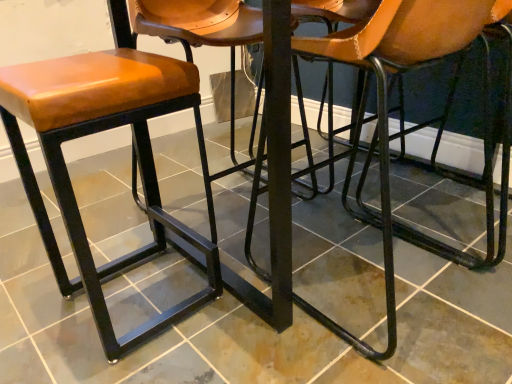
Locate an element on the screen. free region on the left part of matte brown leather stool at left is located at coordinates (37, 306).